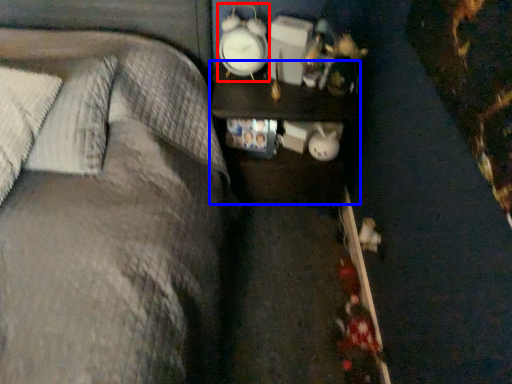
Question: Which object appears closest to the camera in this image, clock (highlighted by a red box) or nightstand (highlighted by a blue box)?

Choices:
 (A) clock
 (B) nightstand

Answer: (A)